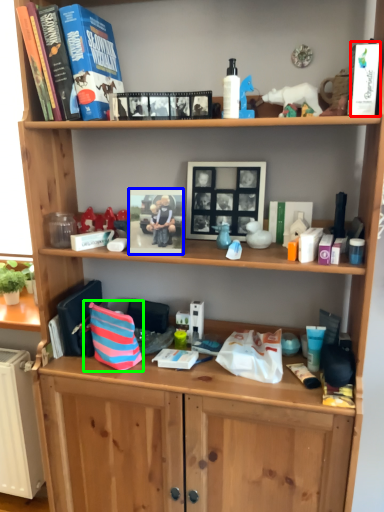
Question: Estimate the real-world distances between objects in this image. Which object is closer to paperback book (highlighted by a red box), picture frame (highlighted by a blue box) or shopping bag (highlighted by a green box)?

Choices:
 (A) picture frame
 (B) shopping bag

Answer: (A)